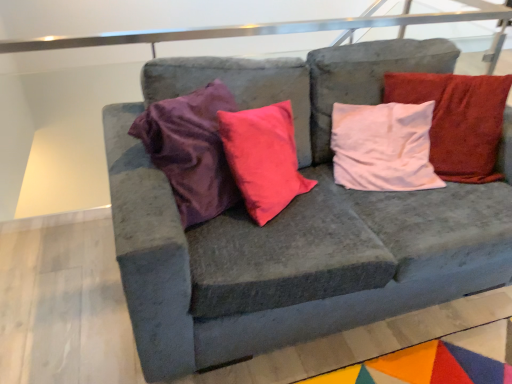
Question: Can you confirm if velvet gray couch at center is taller than white soft pillow at upper right?

Choices:
 (A) yes
 (B) no

Answer: (A)

Question: Is velvet gray couch at center facing towards white soft pillow at upper right?

Choices:
 (A) yes
 (B) no

Answer: (A)

Question: Is velvet gray couch at center behind white soft pillow at upper right?

Choices:
 (A) yes
 (B) no

Answer: (B)

Question: Is velvet gray couch at center wider than white soft pillow at upper right?

Choices:
 (A) no
 (B) yes

Answer: (B)

Question: Can you see velvet gray couch at center touching white soft pillow at upper right?

Choices:
 (A) yes
 (B) no

Answer: (B)

Question: From a real-world perspective, is velvet gray couch at center physically below white soft pillow at upper right?

Choices:
 (A) no
 (B) yes

Answer: (B)

Question: Considering the relative positions of white soft pillow at upper right and velvet gray couch at center in the image provided, is white soft pillow at upper right to the left of velvet gray couch at center from the viewer's perspective?

Choices:
 (A) no
 (B) yes

Answer: (A)

Question: Would you say white soft pillow at upper right is a long distance from velvet gray couch at center?

Choices:
 (A) yes
 (B) no

Answer: (B)

Question: Can you confirm if white soft pillow at upper right is taller than velvet gray couch at center?

Choices:
 (A) no
 (B) yes

Answer: (A)

Question: Can you confirm if white soft pillow at upper right is thinner than velvet gray couch at center?

Choices:
 (A) yes
 (B) no

Answer: (A)

Question: From the image's perspective, is white soft pillow at upper right on top of velvet gray couch at center?

Choices:
 (A) no
 (B) yes

Answer: (B)

Question: Is the depth of white soft pillow at upper right greater than that of velvet gray couch at center?

Choices:
 (A) yes
 (B) no

Answer: (A)

Question: Can you confirm if white soft pillow at upper right is bigger than multicolored felt mat at lower right?

Choices:
 (A) yes
 (B) no

Answer: (A)